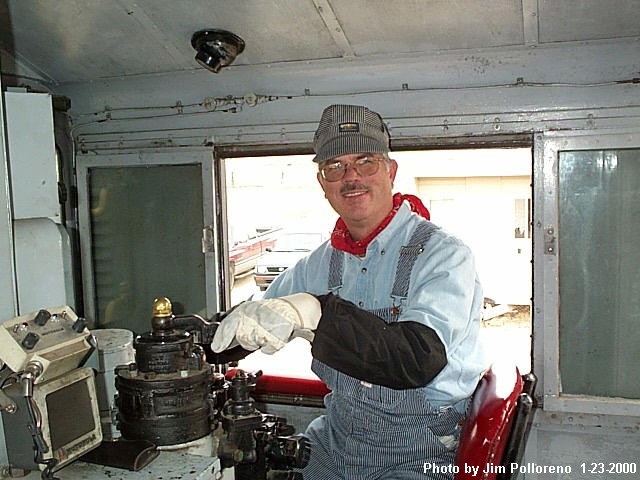
In order to click on windows in this screenshot , I will do `click(594, 277)`, `click(156, 210)`.